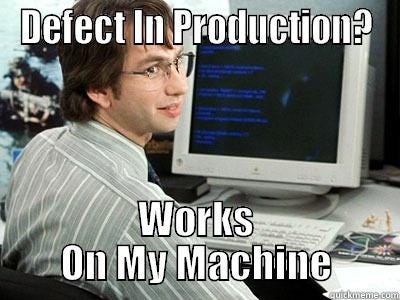
Identify the location of monitor. This screenshot has width=400, height=300. (274, 117).